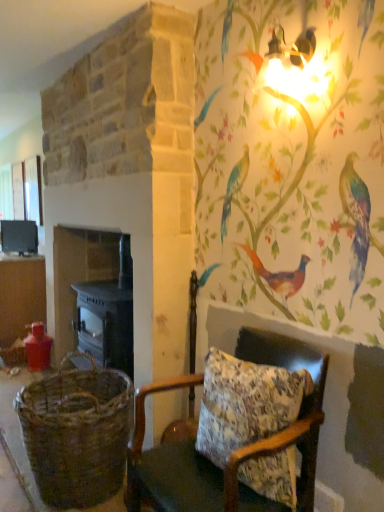
Question: From a real-world perspective, relative to matte black stove at left, is floral fabric cushion at lower right vertically above or below?

Choices:
 (A) below
 (B) above

Answer: (A)

Question: Considering the positions of floral fabric cushion at lower right and matte black stove at left in the image, is floral fabric cushion at lower right taller or shorter than matte black stove at left?

Choices:
 (A) tall
 (B) short

Answer: (A)

Question: Which is farther from the floral fabric cushion at lower right?

Choices:
 (A) woven brown basket at lower left
 (B) matte brown table at left
 (C) dark gray stone fireplace at left
 (D) matte black stove at left

Answer: (D)

Question: Which object is positioned closest to the floral fabric cushion at lower right?

Choices:
 (A) matte brown table at left
 (B) woven brown basket at lower left
 (C) matte black stove at left
 (D) dark gray stone fireplace at left

Answer: (B)